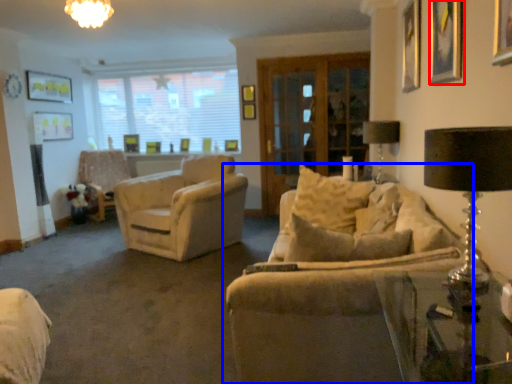
Question: Which point is closer to the camera, picture frame (highlighted by a red box) or studio couch (highlighted by a blue box)?

Choices:
 (A) picture frame
 (B) studio couch

Answer: (B)